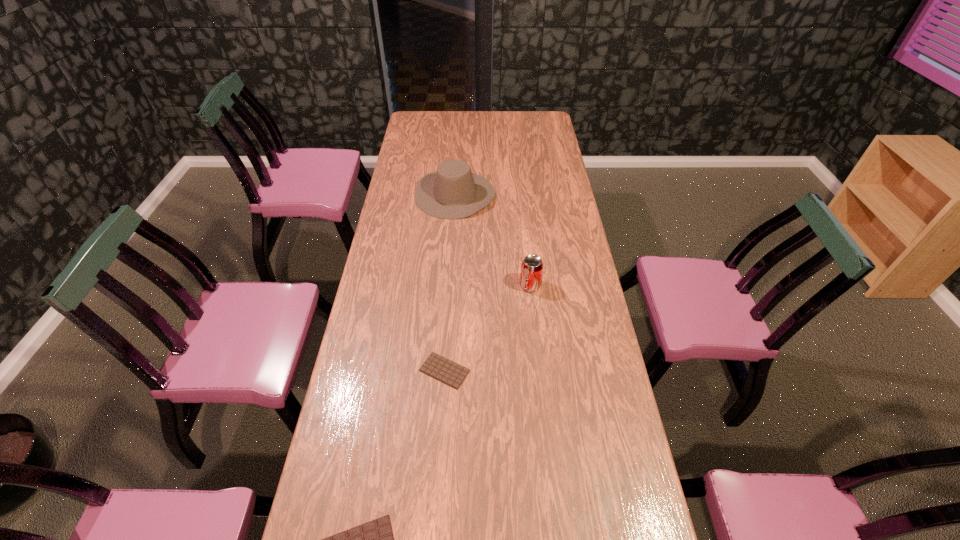
At what (x,y) coordinates should I click in order to perform the action: click on free space that satisfies the following two spatial constraints: 1. on the front side of the cowboy hat; 2. on the right side of the soda can. Please return your answer as a coordinate pair (x, y). This screenshot has width=960, height=540. Looking at the image, I should click on tap(449, 286).